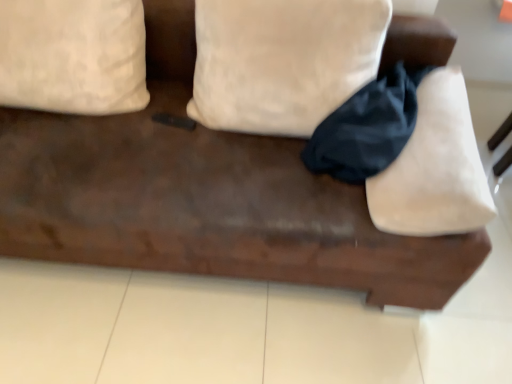
What is the approximate height of dark blue fabric at upper right?

dark blue fabric at upper right is 27.06 centimeters in height.

The width and height of the screenshot is (512, 384). What do you see at coordinates (367, 127) in the screenshot?
I see `dark blue fabric at upper right` at bounding box center [367, 127].

At what (x,y) coordinates should I click in order to perform the action: click on dark blue fabric at upper right. Please return your answer as a coordinate pair (x, y). This screenshot has width=512, height=384. Looking at the image, I should click on (367, 127).

The height and width of the screenshot is (384, 512). I want to click on dark blue fabric at upper right, so click(367, 127).